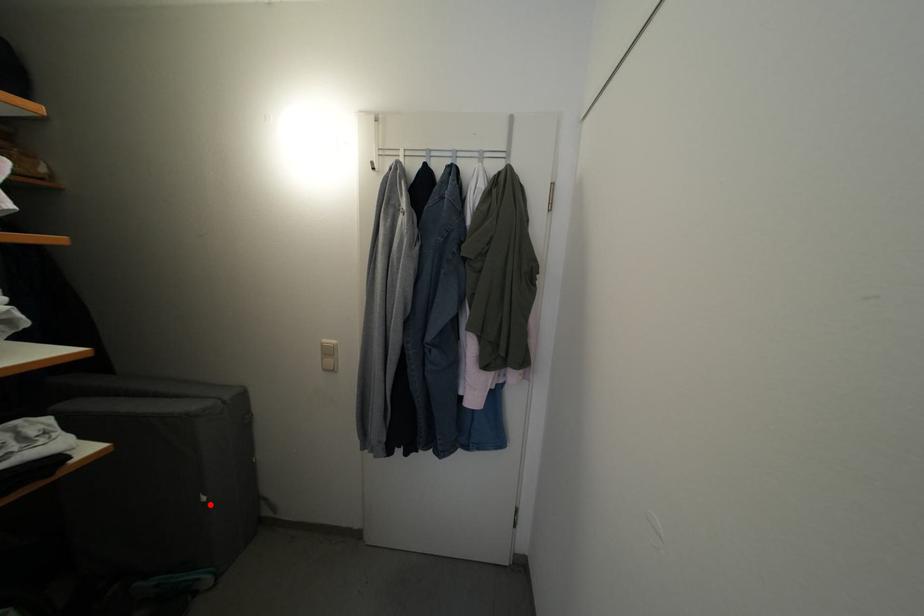
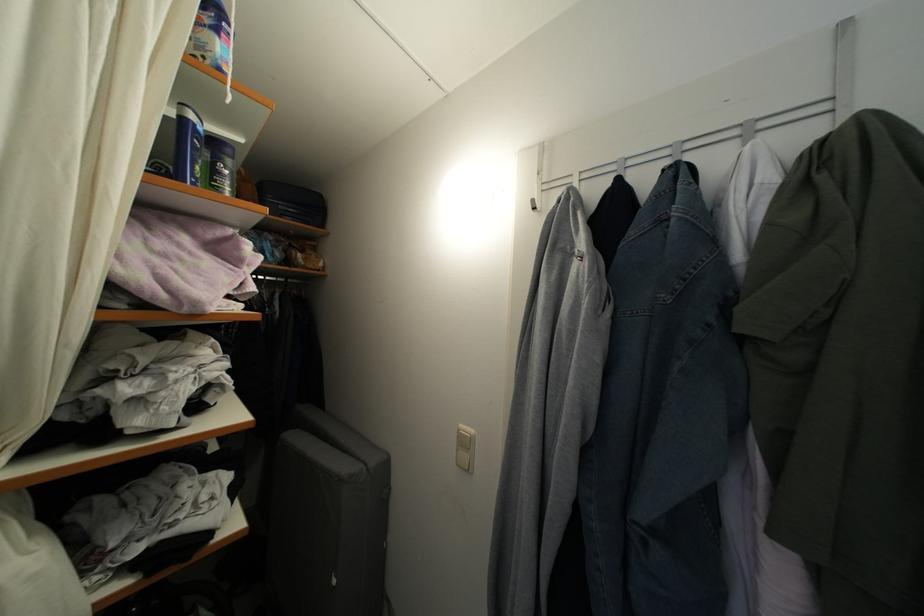
Question: I am providing you with two images of the same scene from different viewpoints. A red point is marked on the first image. At the location where the point appears in image 1, is it still visible in image 2?

Choices:
 (A) Yes
 (B) No

Answer: (A)